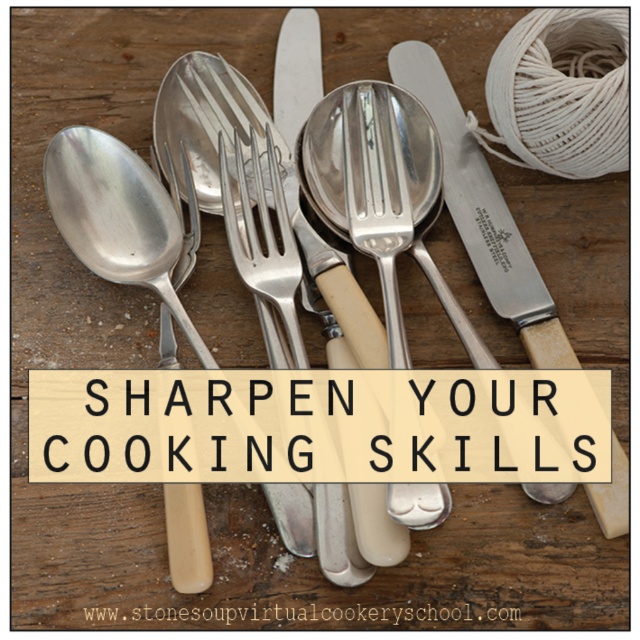
Which is below, silver metallic spoon at upper center or shiny silver spoon at center?

→ silver metallic spoon at upper center is below.

Is silver metallic spoon at upper center to the right of shiny silver spoon at center from the viewer's perspective?

Correct, you'll find silver metallic spoon at upper center to the right of shiny silver spoon at center.

Find the location of `silver metallic spoon at upper center`. silver metallic spoon at upper center is located at coordinates (483, 212).

Can you confirm if silver metallic fork at center is positioned to the left of shiny silver spoon at center?

A: Incorrect, silver metallic fork at center is not on the left side of shiny silver spoon at center.

Which is behind, point (348, 140) or point (166, 316)?

Point (348, 140)

Is point (392, 342) farther from camera compared to point (180, 276)?

No, it is in front of (180, 276).

Locate an element on the screen. silver metallic fork at center is located at coordinates (387, 186).

Does brushed metal spoon at left have a lesser width compared to silver metallic fork at center?

Incorrect, brushed metal spoon at left's width is not less than silver metallic fork at center's.

Can you confirm if brushed metal spoon at left is positioned to the right of silver metallic fork at center?

Incorrect, brushed metal spoon at left is not on the right side of silver metallic fork at center.

What do you see at coordinates (124, 220) in the screenshot? This screenshot has height=640, width=640. I see `brushed metal spoon at left` at bounding box center [124, 220].

Find the location of a particular element. brushed metal spoon at left is located at coordinates (124, 220).